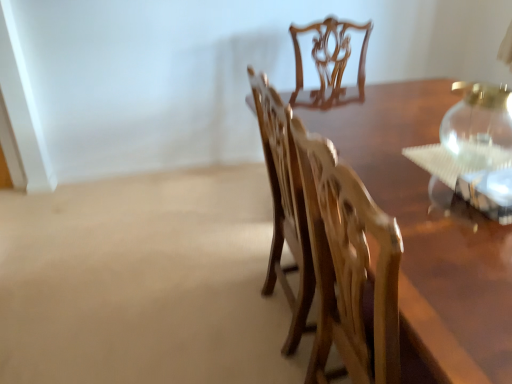
Question: From a real-world perspective, is wooden chair at center above or below transparent glass vase at upper right?

Choices:
 (A) below
 (B) above

Answer: (A)

Question: In the image, is wooden chair at center on the left side or the right side of transparent glass vase at upper right?

Choices:
 (A) left
 (B) right

Answer: (A)

Question: Is wooden chair at center taller or shorter than transparent glass vase at upper right?

Choices:
 (A) tall
 (B) short

Answer: (A)

Question: In terms of size, does transparent glass vase at upper right appear bigger or smaller than wooden chair at center?

Choices:
 (A) big
 (B) small

Answer: (B)

Question: Looking at their shapes, would you say transparent glass vase at upper right is wider or thinner than wooden chair at center?

Choices:
 (A) wide
 (B) thin

Answer: (B)

Question: Would you say transparent glass vase at upper right is inside or outside wooden chair at center?

Choices:
 (A) inside
 (B) outside

Answer: (B)

Question: Is point (500, 150) closer or farther from the camera than point (379, 266)?

Choices:
 (A) farther
 (B) closer

Answer: (A)